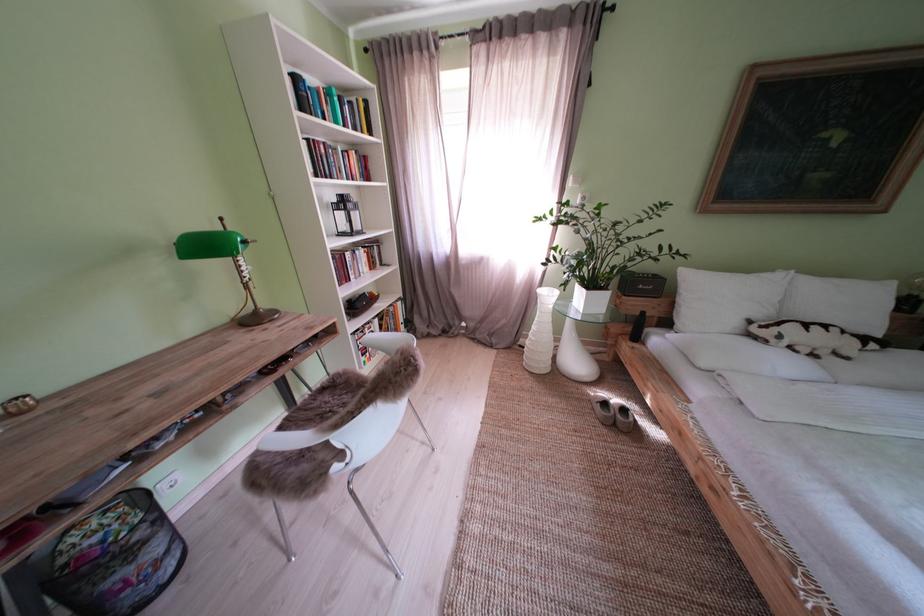
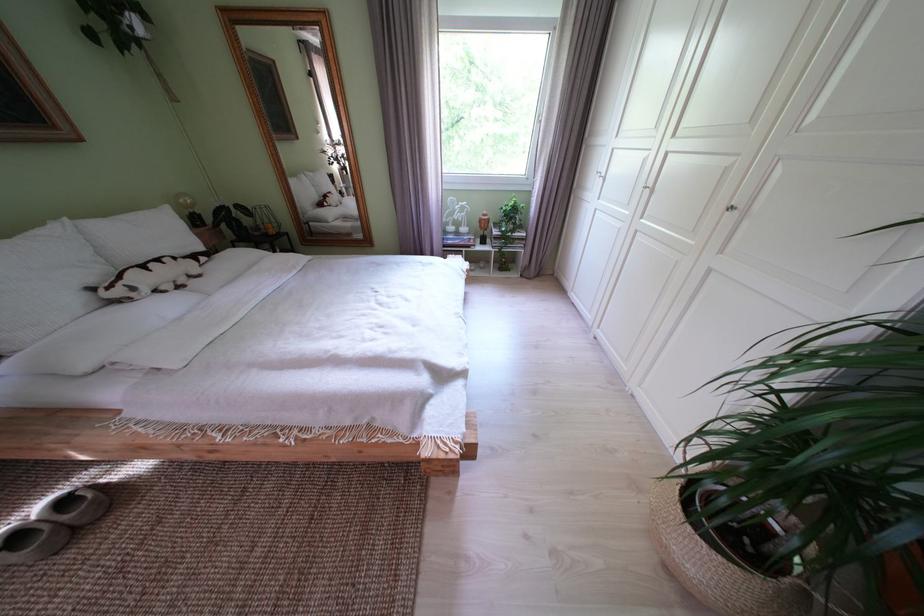
First-person continuous shooting, in which direction is the camera rotating?

The camera's rotation is toward right-down.